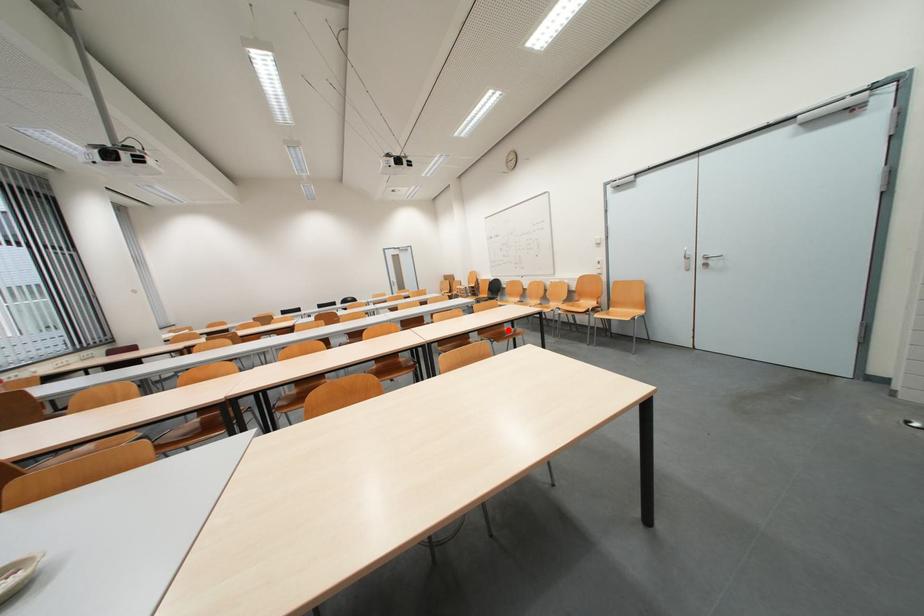
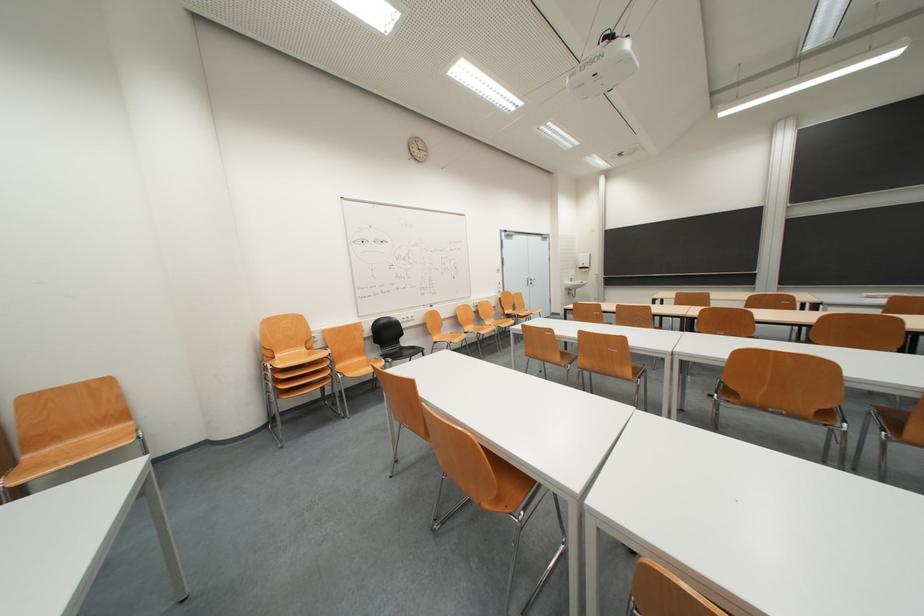
Question: I am providing you with two images of the same scene from different viewpoints. A red point is marked on the first image. Can you still see the location of the red point in image 2?

Choices:
 (A) Yes
 (B) No

Answer: (B)